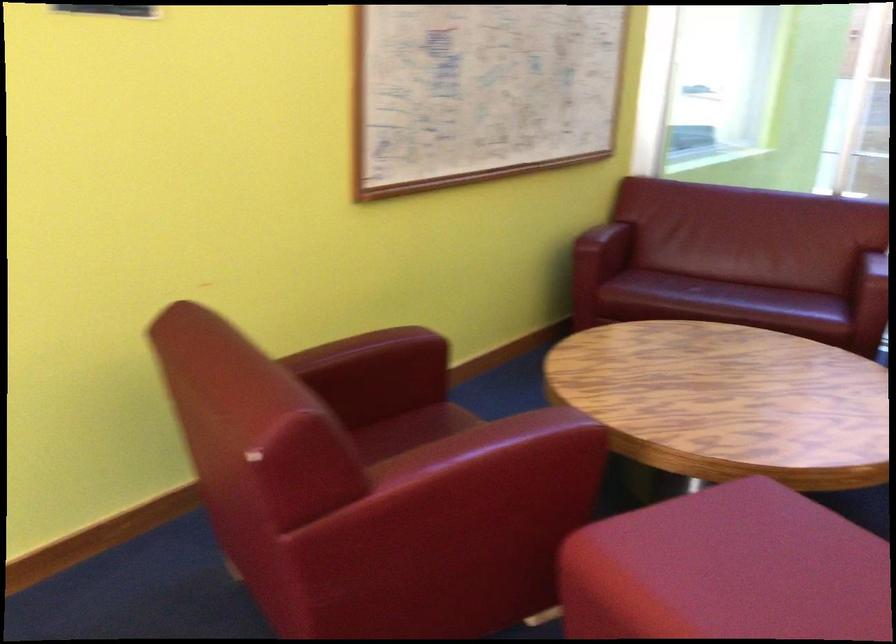
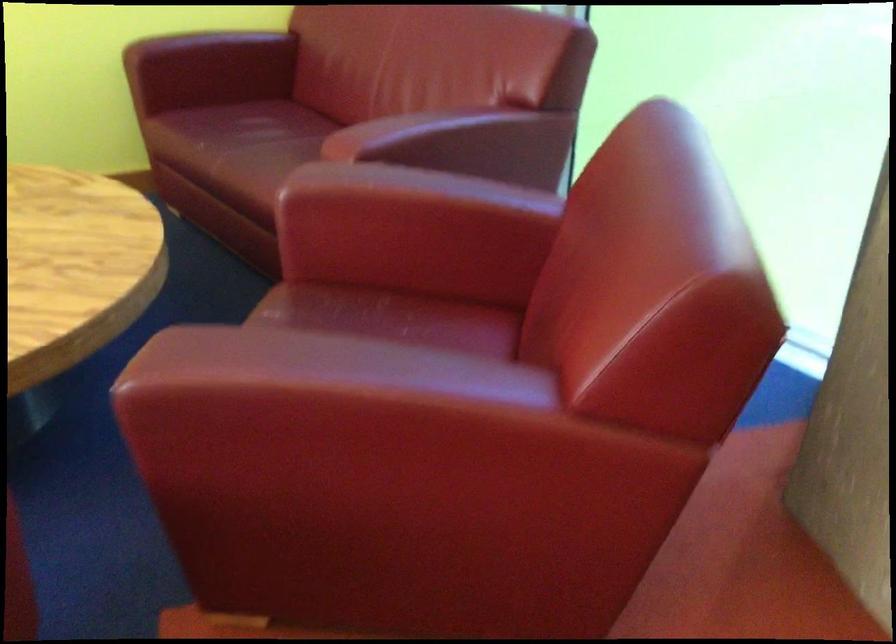
In the second image, find the point that corresponds to [615,243] in the first image.

(208, 69)